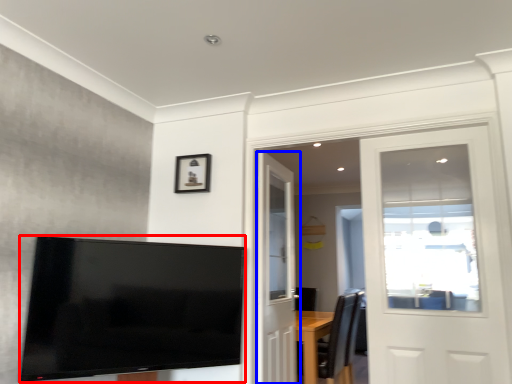
Question: Which point is further to the camera, television (highlighted by a red box) or door (highlighted by a blue box)?

Choices:
 (A) television
 (B) door

Answer: (B)